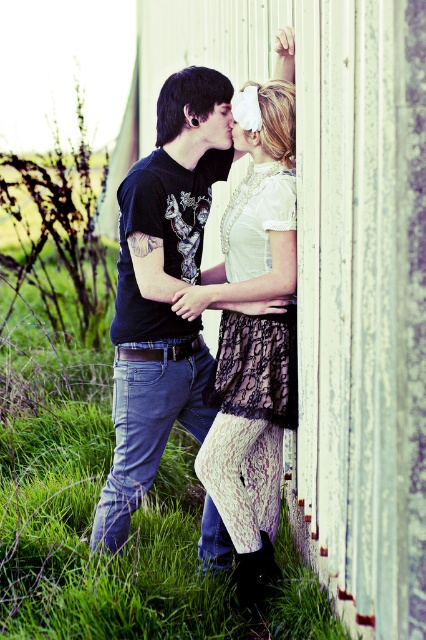
Question: Which point is farther to the camera?

Choices:
 (A) white painted wood at upper center
 (B) white lace dress at center
 (C) matte black t-shirt at center

Answer: (C)

Question: Can you confirm if matte black t-shirt at center is positioned to the right of white lace dress at center?

Choices:
 (A) yes
 (B) no

Answer: (B)

Question: Does white painted wood at upper center lie in front of matte white nose at upper center?

Choices:
 (A) no
 (B) yes

Answer: (B)

Question: Which object is the farthest from the matte white nose at upper center?

Choices:
 (A) white lace dress at center
 (B) white painted wood at upper center

Answer: (B)

Question: Which of these objects is positioned closest to the white painted wood at upper center?

Choices:
 (A) matte white nose at upper center
 (B) white lace dress at center

Answer: (B)

Question: Is white lace dress at center positioned at the back of matte white nose at upper center?

Choices:
 (A) no
 (B) yes

Answer: (A)